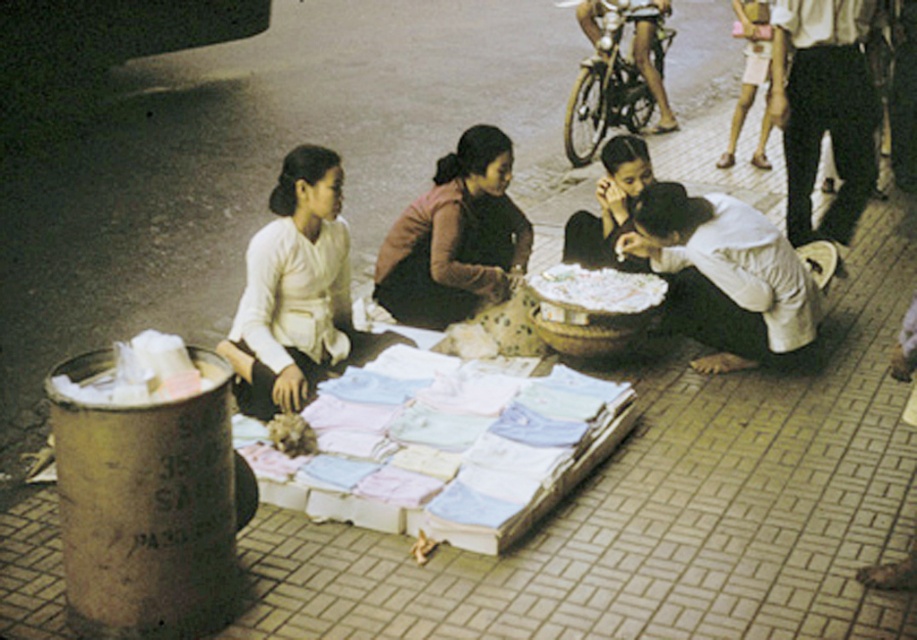
Question: Which object is farther from the camera taking this photo?

Choices:
 (A) pale blue cotton shirts at center
 (B) dark gray pants at right
 (C) white matte fabric at lower center
 (D) matte white blouse at left

Answer: (B)

Question: Which point is closer to the camera?

Choices:
 (A) matte pink sweater at center
 (B) pale blue cotton shirts at center

Answer: (B)

Question: Can you confirm if pale blue cotton shirts at center is positioned above white matte fabric at lower center?

Choices:
 (A) yes
 (B) no

Answer: (B)

Question: Can you confirm if matte pink sweater at center is positioned above dark gray pants at right?

Choices:
 (A) no
 (B) yes

Answer: (A)

Question: Which object is positioned farthest from the white matte fabric at lower center?

Choices:
 (A) matte white blouse at left
 (B) matte pink sweater at center

Answer: (A)

Question: Can you confirm if matte pink sweater at center is wider than dark gray pants at right?

Choices:
 (A) yes
 (B) no

Answer: (A)